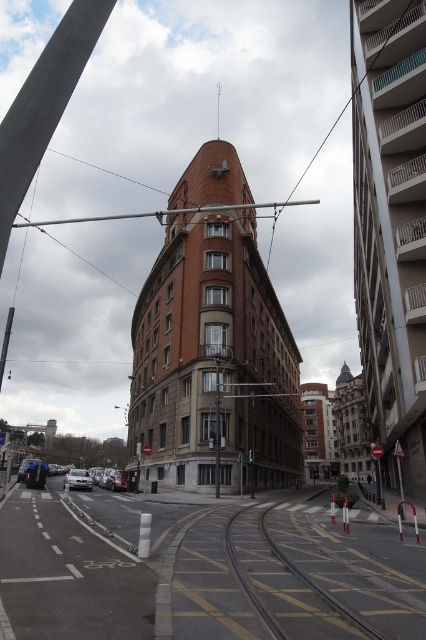
Question: Considering the real-world distances, which object is closest to the yellow textured train track at center?

Choices:
 (A) silver metallic car at lower left
 (B) silver metallic sedan at lower left

Answer: (A)

Question: Is yellow textured train track at center bigger than silver metallic sedan at lower left?

Choices:
 (A) no
 (B) yes

Answer: (A)

Question: Which object appears closest to the camera in this image?

Choices:
 (A) yellow textured train track at center
 (B) silver metallic sedan at lower left
 (C) silver metallic car at lower left

Answer: (A)

Question: Is yellow textured train track at center further to the viewer compared to silver metallic sedan at lower left?

Choices:
 (A) no
 (B) yes

Answer: (A)

Question: Which point is farther to the camera?

Choices:
 (A) silver metallic car at lower left
 (B) silver metallic sedan at lower left
 (C) yellow textured train track at center

Answer: (A)

Question: Is the position of yellow textured train track at center less distant than that of silver metallic car at lower left?

Choices:
 (A) no
 (B) yes

Answer: (B)